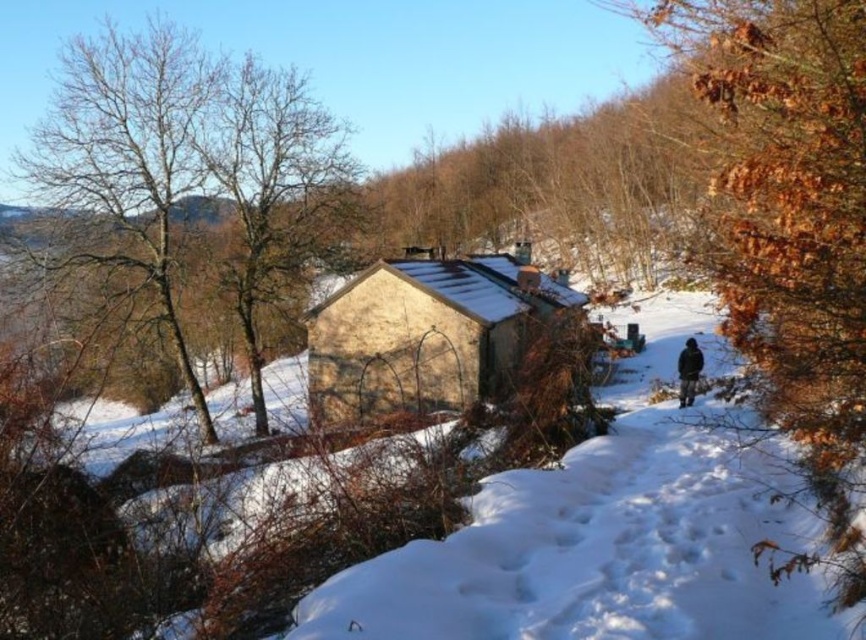
Measure the distance from bare wood tree at upper left to black woolen jacket at lower right.

The distance of bare wood tree at upper left from black woolen jacket at lower right is 17.04 meters.

Can you confirm if bare wood tree at upper left is bigger than black woolen jacket at lower right?

Correct, bare wood tree at upper left is larger in size than black woolen jacket at lower right.

Which is behind, point (50, 150) or point (682, 365)?

The point (50, 150) is behind.

In order to click on bare wood tree at upper left in this screenshot , I will do `click(128, 154)`.

In the scene shown: Which of these two, yellow stucco cabin at center or black woolen jacket at lower right, stands taller?

yellow stucco cabin at center is taller.

Between yellow stucco cabin at center and black woolen jacket at lower right, which one is positioned higher?

yellow stucco cabin at center is above.

Which is in front, point (325, 339) or point (684, 394)?

Point (684, 394)

Where is `yellow stucco cabin at center`? This screenshot has height=640, width=866. yellow stucco cabin at center is located at coordinates (422, 333).

Between point (132, 48) and point (317, 401), which one is positioned behind?

Positioned behind is point (132, 48).

Is bare wood tree at upper left to the right of yellow stucco cabin at center from the viewer's perspective?

No, bare wood tree at upper left is not to the right of yellow stucco cabin at center.

This screenshot has height=640, width=866. I want to click on bare wood tree at upper left, so click(x=128, y=154).

This screenshot has height=640, width=866. Find the location of `bare wood tree at upper left`. bare wood tree at upper left is located at coordinates pos(128,154).